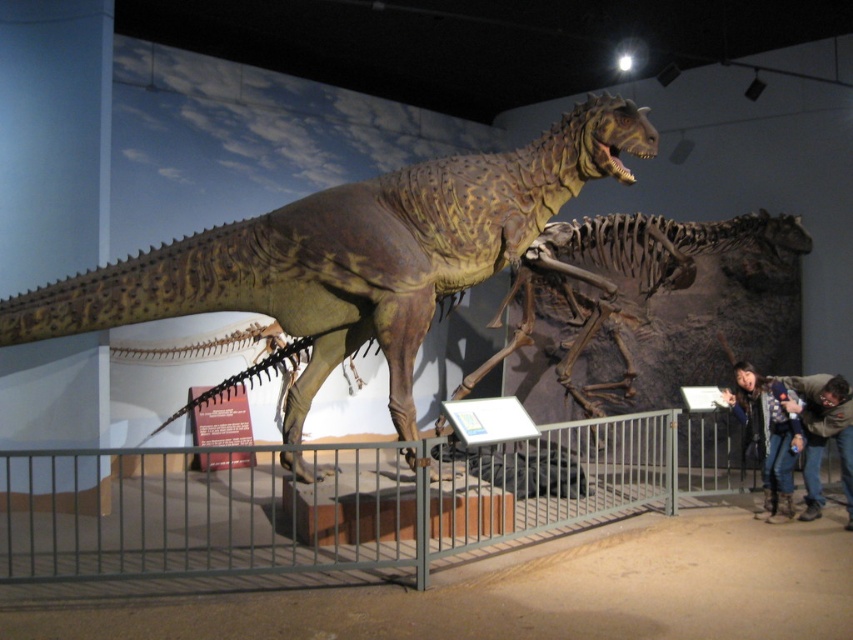
You are a photographer standing at the camera position in the museum. You want to take a closeup photo of the shiny brown dinosaur at center. The camera has a minimum focusing distance of 5 meters. Will you be able to take the photo without moving closer?

The shiny brown dinosaur at center is 4.97 meters away from camera. Since the minimum focusing distance is 5 meters, the camera cannot focus at 4.97 meters. Therefore, you cannot take the photo without moving closer.

You are a visitor at the museum and want to take a photo of the brown textured skeleton at center without any obstructions. Is the dark gray jeans at lower right blocking your view?

The dark gray jeans at lower right is behind the brown textured skeleton at center, so it won not block your view.

You are standing in the museum and want to take a photo of the T. rex model without any obstructions. The railing is located at point (312, 320). Can you step back far enough to capture the entire T. rex model in your photo?

The distance between you and the railing at point (312, 320) is 5.22 meters. Since the railing is between you and the T. rex model, stepping back might not help. To avoid obstructions, move to the side of the railing where the T. rex model is visible without the railing blocking the view.